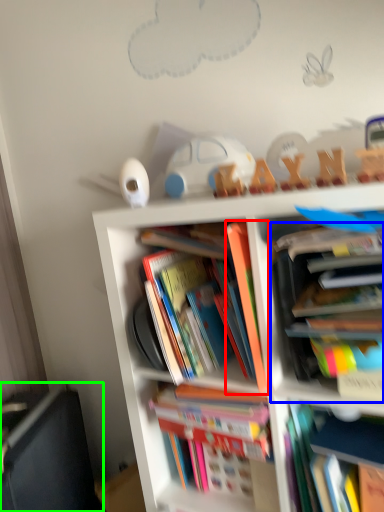
Question: Which object is positioned closest to book (highlighted by a red box)? Select from book (highlighted by a blue box) and shelf (highlighted by a green box).

Choices:
 (A) book
 (B) shelf

Answer: (A)